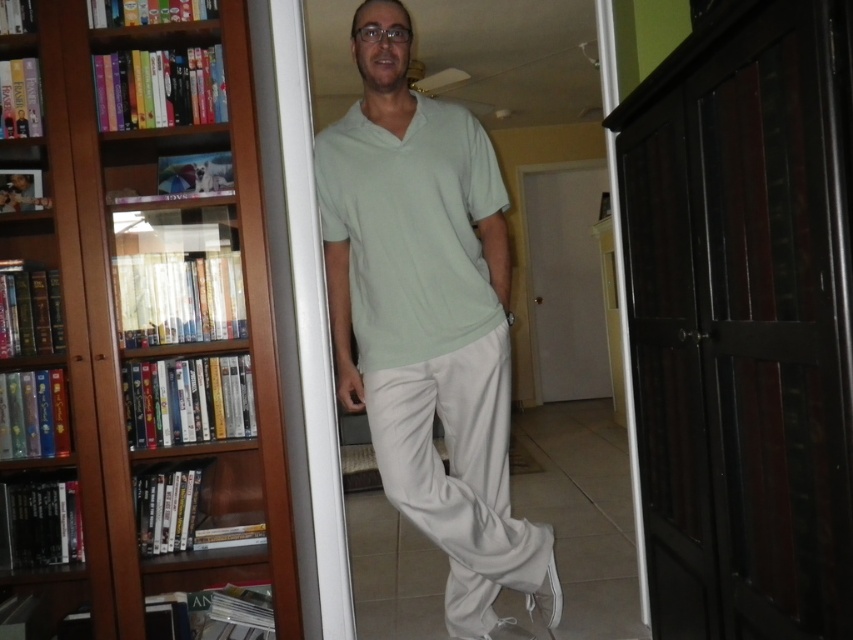
Question: Can you confirm if wooden bookcase at left is smaller than white cotton pants at center?

Choices:
 (A) yes
 (B) no

Answer: (B)

Question: Does light green fabric shirt at center appear on the right side of light green cotton shirt at center?

Choices:
 (A) no
 (B) yes

Answer: (B)

Question: Among these objects, which one is nearest to the camera?

Choices:
 (A) white cotton pants at center
 (B) wooden bookcase at left
 (C) light green cotton shirt at center

Answer: (B)

Question: Which point is closer to the camera?

Choices:
 (A) (447, 129)
 (B) (103, 436)

Answer: (B)

Question: Observing the image, what is the correct spatial positioning of light green fabric shirt at center in reference to light green cotton shirt at center?

Choices:
 (A) right
 (B) left

Answer: (A)

Question: Among these objects, which one is nearest to the camera?

Choices:
 (A) white cotton pants at center
 (B) light green cotton shirt at center
 (C) light green fabric shirt at center

Answer: (A)